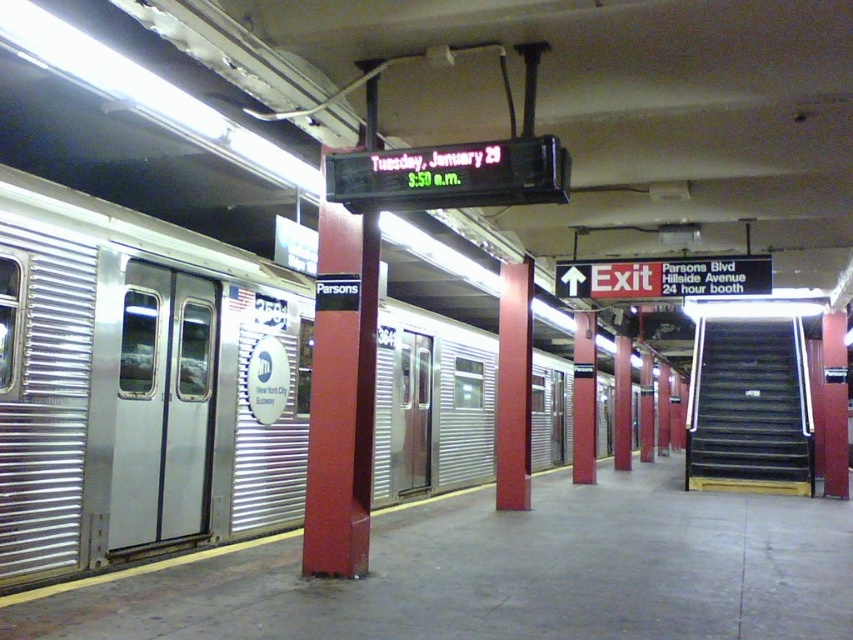
You are standing on the subway platform and want to take a photo of the silver metallic train at left with your phone. Your phone has a maximum focus distance of 5 meters. Will you be able to capture the entire train in the photo?

The silver metallic train at left and camera are 5.09 meters apart. Since the maximum focus distance is 5 meters, the camera cannot focus on the silver metallic train at left because it is slightly beyond the 5 meter limit.

You are a subway passenger waiting on the platform. You see the silver metallic train at left and the metallic red pillar at center. Which object is closer to the ground?

The silver metallic train at left is closer to the ground because it is below the metallic red pillar at center.

You are waiting on the subway platform and need to board the silver metallic train at left before the black metal stairs at right. Which direction should you walk towards?

You should walk towards the silver metallic train at left because it is closer to you than the black metal stairs at right.